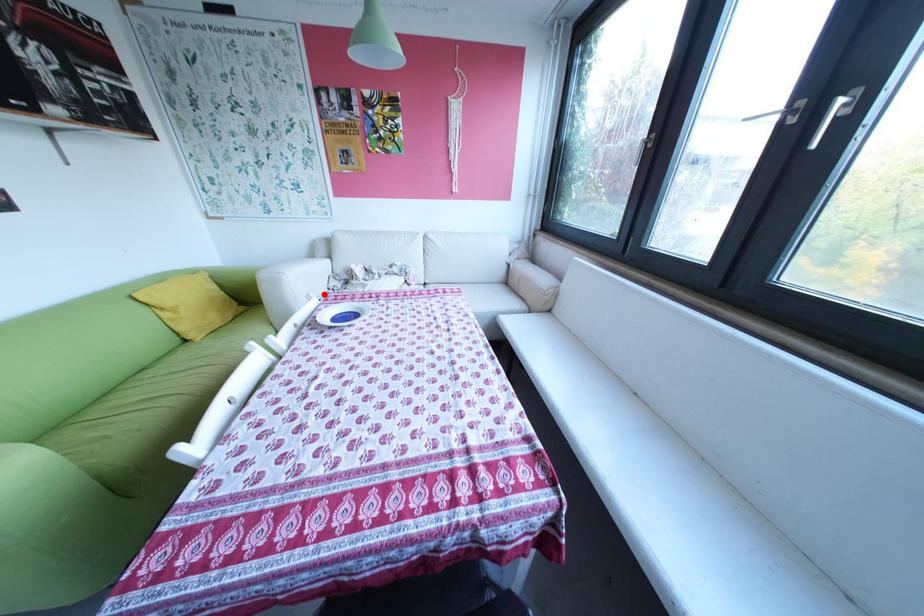
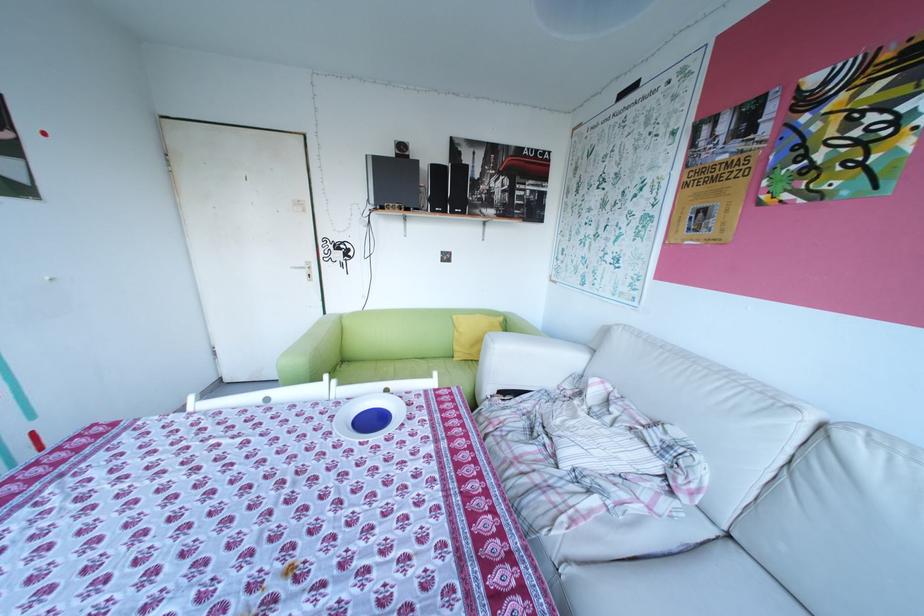
Where in the second image is the point corresponding to the highlighted location from the first image?

(448, 374)